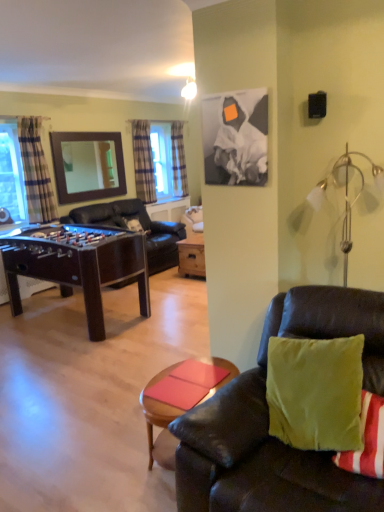
Question: Is dark brown leather couch at center, positioned as the first studio couch in top-to-bottom order, behind wooden mirror at upper left?

Choices:
 (A) yes
 (B) no

Answer: (B)

Question: Is dark brown leather couch at center, placed as the first studio couch when sorted from left to right, at the left side of wooden mirror at upper left?

Choices:
 (A) no
 (B) yes

Answer: (A)

Question: Is dark brown leather couch at center, acting as the 1th studio couch starting from the back, positioned far away from wooden mirror at upper left?

Choices:
 (A) yes
 (B) no

Answer: (B)

Question: Considering the relative sizes of dark brown leather couch at center, acting as the 2th studio couch starting from the right, and wooden mirror at upper left in the image provided, is dark brown leather couch at center, acting as the 2th studio couch starting from the right, wider than wooden mirror at upper left?

Choices:
 (A) yes
 (B) no

Answer: (A)

Question: Is dark brown leather couch at center, acting as the 1th studio couch starting from the back, closer to the viewer compared to wooden mirror at upper left?

Choices:
 (A) yes
 (B) no

Answer: (A)

Question: From a real-world perspective, is dark brown leather couch at center, the 2th studio couch positioned from the bottom, under wooden mirror at upper left?

Choices:
 (A) no
 (B) yes

Answer: (B)

Question: Does mahogany wood foosball table at left appear on the left side of plaid fabric curtain at center, the second curtain in the left-to-right sequence?

Choices:
 (A) yes
 (B) no

Answer: (A)

Question: From the image's perspective, is mahogany wood foosball table at left beneath plaid fabric curtain at center, marked as the second curtain in a front-to-back arrangement?

Choices:
 (A) no
 (B) yes

Answer: (B)

Question: Would you consider mahogany wood foosball table at left to be distant from plaid fabric curtain at center, marked as the second curtain in a front-to-back arrangement?

Choices:
 (A) no
 (B) yes

Answer: (B)

Question: Can you confirm if mahogany wood foosball table at left is taller than plaid fabric curtain at center, marked as the second curtain in a front-to-back arrangement?

Choices:
 (A) yes
 (B) no

Answer: (B)

Question: From the image's perspective, does mahogany wood foosball table at left appear higher than plaid fabric curtain at center, positioned as the 2th curtain in back-to-front order?

Choices:
 (A) yes
 (B) no

Answer: (B)

Question: From a real-world perspective, is mahogany wood foosball table at left located higher than plaid fabric curtain at center, the second curtain in the left-to-right sequence?

Choices:
 (A) no
 (B) yes

Answer: (A)

Question: Can you confirm if plaid fabric curtain at center, the second curtain viewed from the right, is smaller than mahogany wood foosball table at left?

Choices:
 (A) yes
 (B) no

Answer: (A)